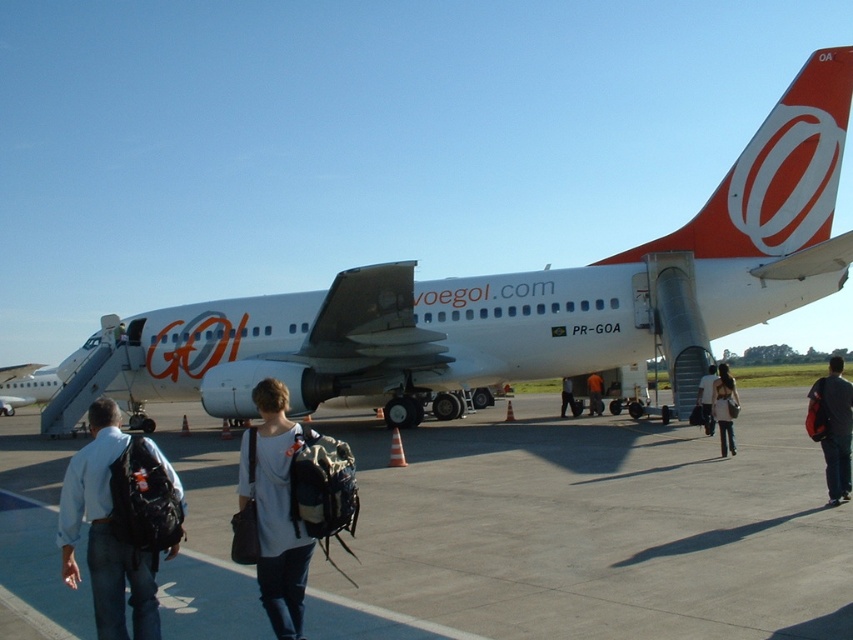
Which is more to the right, dark gray backpack at center or orange fabric backpack at center?

dark gray backpack at center

Is point (848, 406) behind point (590, 396)?

No, (848, 406) is in front of (590, 396).

Who is more forward, (838, 445) or (592, 406)?

Point (838, 445)

Where is `dark gray backpack at center`? Image resolution: width=853 pixels, height=640 pixels. dark gray backpack at center is located at coordinates (834, 428).

Does dark gray backpack at center come behind denim jacket at center?

No.

Which is in front, point (834, 371) or point (561, 381)?

Point (834, 371) is more forward.

I want to click on dark gray backpack at center, so click(834, 428).

I want to click on dark gray backpack at center, so click(834, 428).

In the scene shown: Can you confirm if white matte airliner at center is bigger than dark gray backpack at center?

Incorrect, white matte airliner at center is not larger than dark gray backpack at center.

Does white matte airliner at center have a greater height compared to dark gray backpack at center?

Indeed, white matte airliner at center has a greater height compared to dark gray backpack at center.

The width and height of the screenshot is (853, 640). Find the location of `white matte airliner at center`. white matte airliner at center is located at coordinates (517, 296).